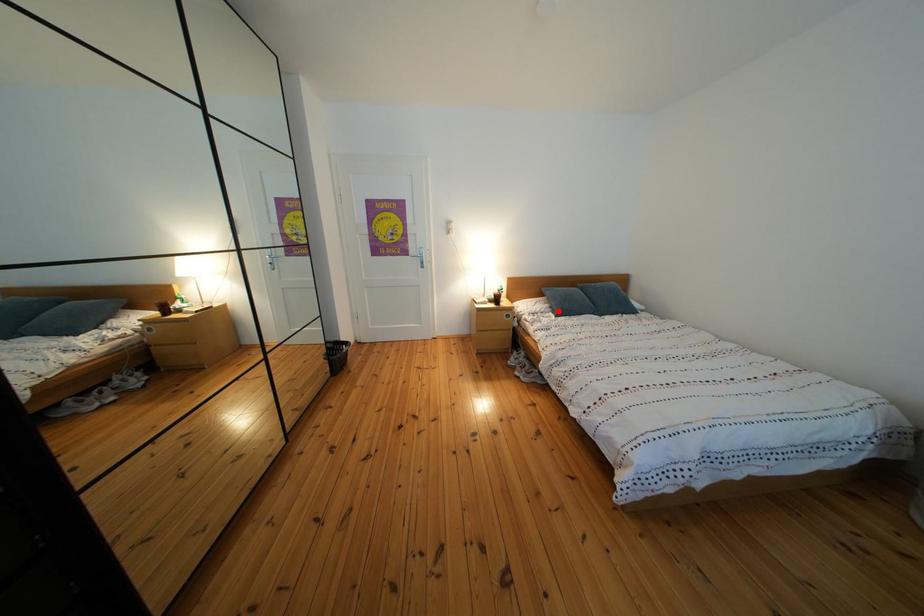
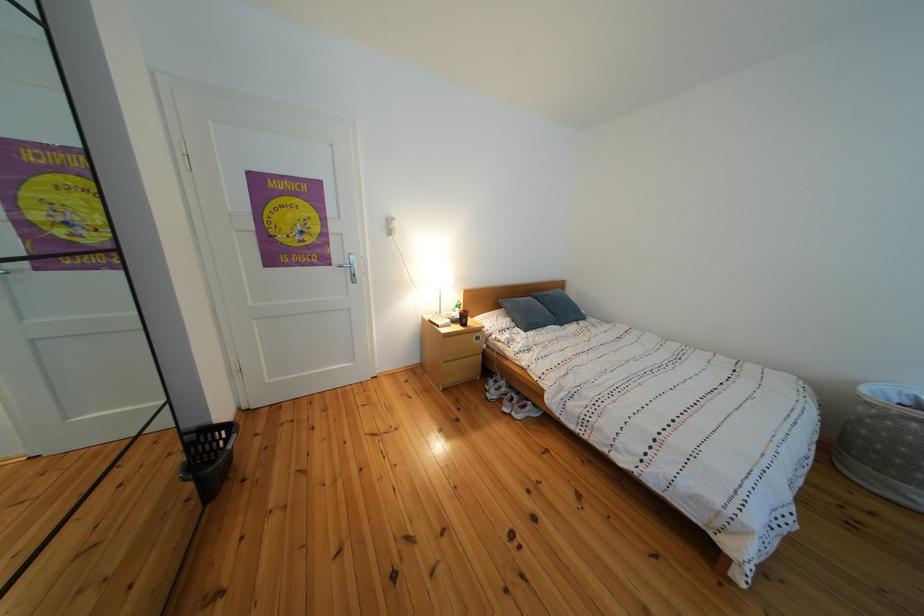
Find the pixel in the second image that matches the highlighted location in the first image.

(519, 325)